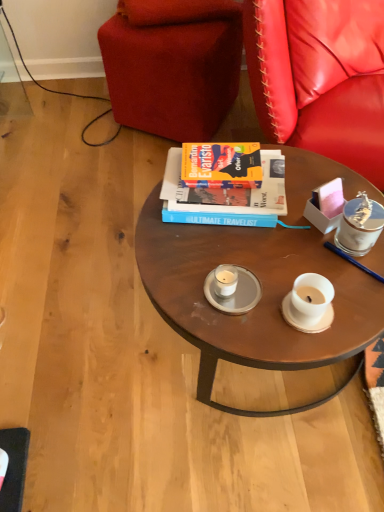
The image size is (384, 512). Identify the location of free space between silver metallic candle at upper right, the first coffee cup from the right, and clear glass saucer at center. (298, 261).